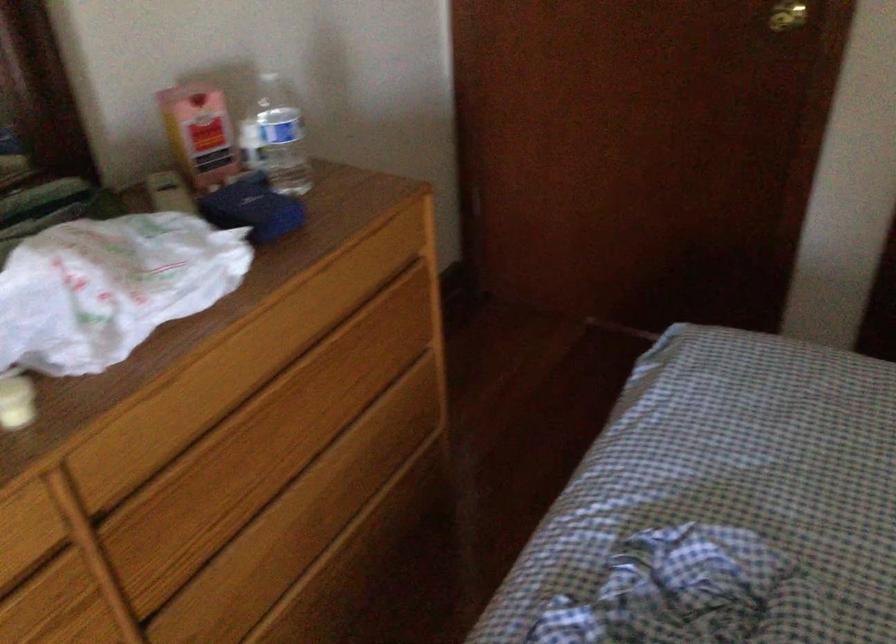
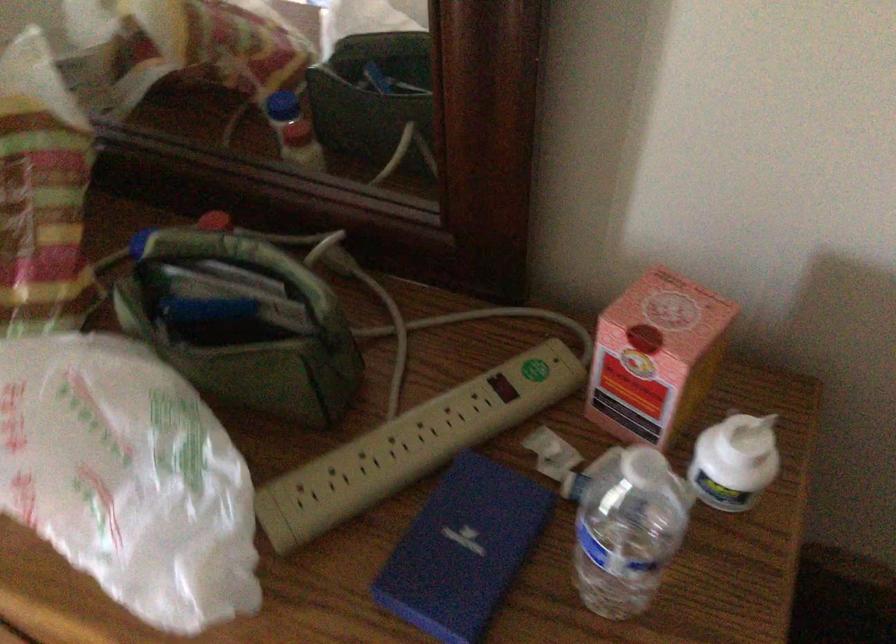
The point at [168,187] is marked in the first image. Where is the corresponding point in the second image?

(503, 386)